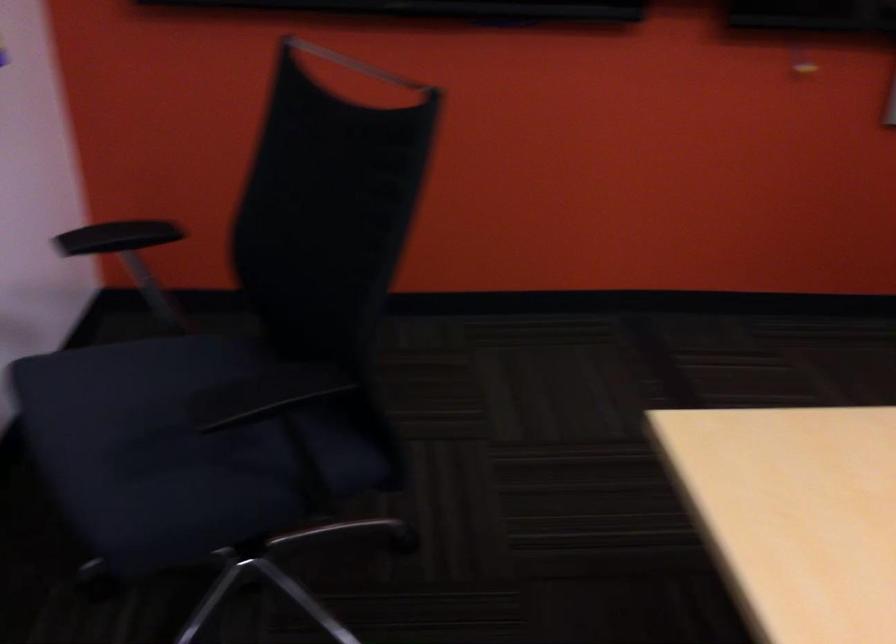
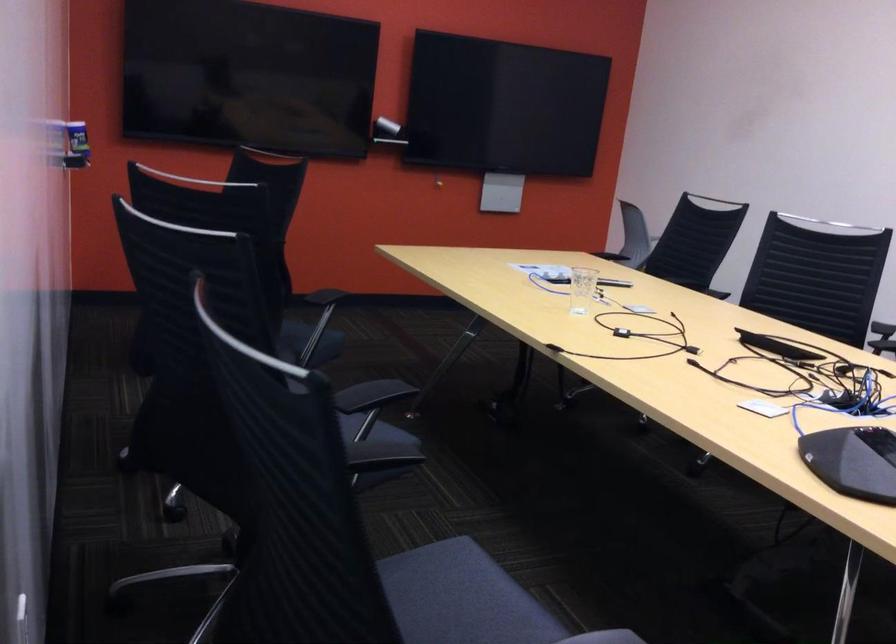
Question: I am providing you with two images of the same scene from different viewpoints. After the viewpoint changes to image2, which objects are now occluded?

Choices:
 (A) white cylindrical container
 (B) black remote control
 (C) black chair armrest
 (D) blue spray can

Answer: (C)